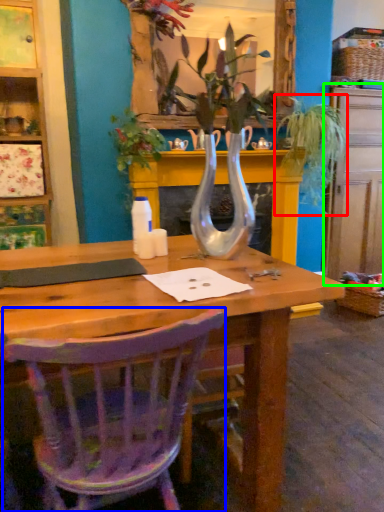
Question: Which object is the farthest from houseplant (highlighted by a red box)? Choose among these: chair (highlighted by a blue box) or dresser (highlighted by a green box).

Choices:
 (A) chair
 (B) dresser

Answer: (A)